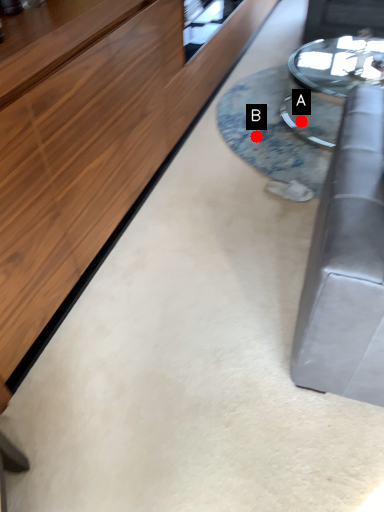
Question: Two points are circled on the image, labeled by A and B beside each circle. Which point is closer to the camera?

Choices:
 (A) A is closer
 (B) B is closer

Answer: (B)